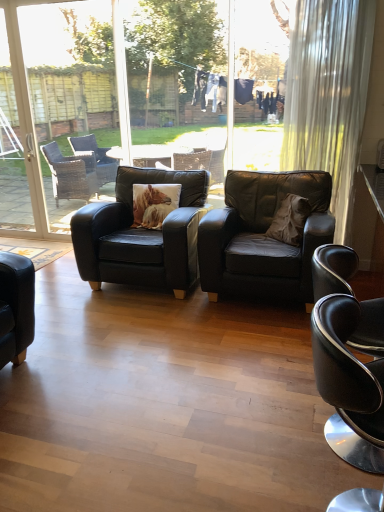
I want to click on matte black armchair at center, the second chair viewed from the front, so click(263, 237).

This screenshot has height=512, width=384. What do you see at coordinates (351, 376) in the screenshot? I see `black leather chair at lower right, which is counted as the 3th chair, starting from the back` at bounding box center [351, 376].

What is the approximate width of brown textured pillow at center, the second pillow when ordered from right to left?

It is 11.13 inches.

The image size is (384, 512). Describe the element at coordinates (290, 220) in the screenshot. I see `brown suede pillow at center, which ranks as the second pillow in left-to-right order` at that location.

At what (x,y) coordinates should I click in order to perform the action: click on matte black armchair at center, placed as the 2th chair when sorted from back to front. Please return your answer as a coordinate pair (x, y). This screenshot has height=512, width=384. Looking at the image, I should click on (263, 237).

Does point (79, 256) appear closer or farther from the camera than point (30, 145)?

Point (79, 256) appears to be closer to the viewer than point (30, 145).

From the image's perspective, which one is positioned higher, matte black armchair at center, marked as the third chair in a front-to-back arrangement, or transparent glass screen door at upper left, which is counted as the first screen door, starting from the right?

transparent glass screen door at upper left, which is counted as the first screen door, starting from the right.

Does matte black armchair at center, marked as the third chair in a front-to-back arrangement, contain transparent glass screen door at upper left, which is counted as the second screen door, starting from the left?

Definitely not — transparent glass screen door at upper left, which is counted as the second screen door, starting from the left, is not inside matte black armchair at center, marked as the third chair in a front-to-back arrangement.

Is transparent glass screen door at upper left, which is counted as the first screen door, starting from the right, at the back of matte black armchair at center, the 1th chair viewed from the back?

No.

Is black leather chair at lower right, which is counted as the 3th chair, starting from the back, smaller than brown textured pillow at center, placed as the first pillow when sorted from left to right?

No, black leather chair at lower right, which is counted as the 3th chair, starting from the back, is not smaller than brown textured pillow at center, placed as the first pillow when sorted from left to right.

Based on the photo, between black leather chair at lower right, the 1th chair from the front, and brown textured pillow at center, placed as the first pillow when sorted from left to right, which one is positioned in front?

black leather chair at lower right, the 1th chair from the front, is in front.

Is point (346, 306) positioned behind point (155, 187)?

No, it is not.

From a real-world perspective, is black leather chair at lower right, the 1th chair from the front, positioned above or below brown textured pillow at center, the second pillow when ordered from right to left?

In terms of real-world spatial position, black leather chair at lower right, the 1th chair from the front, is below brown textured pillow at center, the second pillow when ordered from right to left.

From a real-world perspective, is white sheer curtain at right on top of white glass screen door at left, the 1th screen door viewed from the left?

Correct, in the physical world, white sheer curtain at right is higher than white glass screen door at left, the 1th screen door viewed from the left.

Can you confirm if white sheer curtain at right is wider than white glass screen door at left, the 1th screen door viewed from the left?

Correct, the width of white sheer curtain at right exceeds that of white glass screen door at left, the 1th screen door viewed from the left.

Is point (292, 79) farther from viewer compared to point (36, 159)?

That is False.

Which of these two, white sheer curtain at right or white glass screen door at left, which appears as the 2th screen door when viewed from the right, stands shorter?

With less height is white sheer curtain at right.

Considering the sizes of objects matte black armchair at center, the 1th chair viewed from the back, and brown textured pillow at center, placed as the first pillow when sorted from left to right, in the image provided, who is shorter, matte black armchair at center, the 1th chair viewed from the back, or brown textured pillow at center, placed as the first pillow when sorted from left to right,?

Standing shorter between the two is brown textured pillow at center, placed as the first pillow when sorted from left to right.

Does matte black armchair at center, marked as the third chair in a front-to-back arrangement, turn towards brown textured pillow at center, the second pillow when ordered from right to left?

Yes, matte black armchair at center, marked as the third chair in a front-to-back arrangement, is facing brown textured pillow at center, the second pillow when ordered from right to left.

From a real-world perspective, which is physically above, matte black armchair at center, the 1th chair viewed from the back, or brown textured pillow at center, placed as the first pillow when sorted from left to right?

From a 3D spatial view, brown textured pillow at center, placed as the first pillow when sorted from left to right, is above.

Considering the positions of objects white glass screen door at left, which appears as the 2th screen door when viewed from the right, and white sheer curtain at right in the image provided, who is more to the left, white glass screen door at left, which appears as the 2th screen door when viewed from the right, or white sheer curtain at right?

Positioned to the left is white glass screen door at left, which appears as the 2th screen door when viewed from the right.

Can you confirm if white glass screen door at left, which appears as the 2th screen door when viewed from the right, is bigger than white sheer curtain at right?

Yes.

From the picture: From the image's perspective, does white glass screen door at left, the 1th screen door viewed from the left, appear higher than white sheer curtain at right?

Yes, from the image's perspective, white glass screen door at left, the 1th screen door viewed from the left, is above white sheer curtain at right.

Considering the points (305, 90) and (332, 218), which point is behind, point (305, 90) or point (332, 218)?

The point (305, 90) is farther.

Considering the relative sizes of white sheer curtain at right and matte black armchair at center, the second chair viewed from the front, in the image provided, is white sheer curtain at right smaller than matte black armchair at center, the second chair viewed from the front,?

Yes.

From a real-world perspective, is white sheer curtain at right over matte black armchair at center, placed as the 2th chair when sorted from back to front?

Yes, from a real-world perspective, white sheer curtain at right is above matte black armchair at center, placed as the 2th chair when sorted from back to front.

Considering the sizes of objects white sheer curtain at right and matte black armchair at center, placed as the 2th chair when sorted from back to front, in the image provided, who is thinner, white sheer curtain at right or matte black armchair at center, placed as the 2th chair when sorted from back to front,?

With smaller width is white sheer curtain at right.

From a real-world perspective, between black leather chair at lower right, which is counted as the 3th chair, starting from the back, and matte black armchair at center, marked as the third chair in a front-to-back arrangement, who is vertically higher?

matte black armchair at center, marked as the third chair in a front-to-back arrangement, from a real-world perspective.

Measure the distance between black leather chair at lower right, the 1th chair from the front, and matte black armchair at center, marked as the third chair in a front-to-back arrangement.

black leather chair at lower right, the 1th chair from the front, is 6.62 feet away from matte black armchair at center, marked as the third chair in a front-to-back arrangement.

Looking at their sizes, would you say black leather chair at lower right, which is counted as the 3th chair, starting from the back, is wider or thinner than matte black armchair at center, marked as the third chair in a front-to-back arrangement?

Considering their sizes, black leather chair at lower right, which is counted as the 3th chair, starting from the back, looks slimmer than matte black armchair at center, marked as the third chair in a front-to-back arrangement.

Does point (370, 459) lie in front of point (128, 180)?

That is True.

You are a GUI agent. You are given a task and a screenshot of the screen. Output one action in this format:
    pyautogui.click(x=<x>, y=<y>)
    Task: Click on the 1st screen door above the matte black armchair at center, the 1th chair viewed from the back (from the image's perspective)
    
    Given the screenshot: What is the action you would take?
    pyautogui.click(x=27, y=125)

In order to click on pillow that is the 1st object above the black leather chair at lower right, which is counted as the 3th chair, starting from the back (from a real-world perspective) in this screenshot , I will do click(x=154, y=204).

Considering their positions, is white glass screen door at left, the 1th screen door viewed from the left, positioned closer to transparent glass screen door at upper left, which is counted as the second screen door, starting from the left, than matte black armchair at center, marked as the third chair in a front-to-back arrangement?

Based on the image, white glass screen door at left, the 1th screen door viewed from the left, appears to be nearer to transparent glass screen door at upper left, which is counted as the second screen door, starting from the left.

From the image, which object appears to be nearer to white glass screen door at left, which appears as the 2th screen door when viewed from the right, brown textured pillow at center, placed as the first pillow when sorted from left to right, or matte black armchair at center, marked as the third chair in a front-to-back arrangement?

brown textured pillow at center, placed as the first pillow when sorted from left to right, is positioned closer to the anchor white glass screen door at left, which appears as the 2th screen door when viewed from the right.

Estimate the real-world distances between objects in this image. Which object is further from matte black armchair at center, marked as the third chair in a front-to-back arrangement, white sheer curtain at right or matte black armchair at center, placed as the 2th chair when sorted from back to front?

white sheer curtain at right is positioned further to the anchor matte black armchair at center, marked as the third chair in a front-to-back arrangement.

Based on their spatial positions, is matte black armchair at center, the 1th chair viewed from the back, or white sheer curtain at right closer to matte black armchair at center, placed as the 2th chair when sorted from back to front?

matte black armchair at center, the 1th chair viewed from the back.

When comparing their distances from matte black armchair at center, placed as the 2th chair when sorted from back to front, does brown textured pillow at center, the second pillow when ordered from right to left, or transparent glass screen door at upper left, which is counted as the second screen door, starting from the left, seem closer?

brown textured pillow at center, the second pillow when ordered from right to left.

Which object lies nearer to the anchor point brown textured pillow at center, placed as the first pillow when sorted from left to right, transparent glass screen door at upper left, which is counted as the first screen door, starting from the right, or white glass screen door at left, the 1th screen door viewed from the left?

transparent glass screen door at upper left, which is counted as the first screen door, starting from the right, is closer to brown textured pillow at center, placed as the first pillow when sorted from left to right.

From the image, which object appears to be farther from black leather chair at lower right, which is counted as the 3th chair, starting from the back, matte black armchair at center, placed as the 2th chair when sorted from back to front, or brown textured pillow at center, the second pillow when ordered from right to left?

brown textured pillow at center, the second pillow when ordered from right to left, lies further to black leather chair at lower right, which is counted as the 3th chair, starting from the back, than the other object.

Based on their spatial positions, is white glass screen door at left, which appears as the 2th screen door when viewed from the right, or brown suede pillow at center, which ranks as the second pillow in left-to-right order, closer to white sheer curtain at right?

brown suede pillow at center, which ranks as the second pillow in left-to-right order, is closer to white sheer curtain at right.

Where is `screen door situated between white glass screen door at left, the 1th screen door viewed from the left, and white sheer curtain at right from left to right`? screen door situated between white glass screen door at left, the 1th screen door viewed from the left, and white sheer curtain at right from left to right is located at coordinates (27, 125).

Where is `curtain between black leather chair at lower right, the 1th chair from the front, and transparent glass screen door at upper left, which is counted as the second screen door, starting from the left, from front to back`? curtain between black leather chair at lower right, the 1th chair from the front, and transparent glass screen door at upper left, which is counted as the second screen door, starting from the left, from front to back is located at coordinates (328, 94).

Locate an element on the screen. The width and height of the screenshot is (384, 512). pillow located between white glass screen door at left, the 1th screen door viewed from the left, and brown suede pillow at center, which ranks as the second pillow in left-to-right order, in the left-right direction is located at coordinates (154, 204).

Find the location of a particular element. This screenshot has height=512, width=384. pillow positioned between black leather chair at lower right, which is counted as the 3th chair, starting from the back, and brown textured pillow at center, placed as the first pillow when sorted from left to right, from near to far is located at coordinates (290, 220).